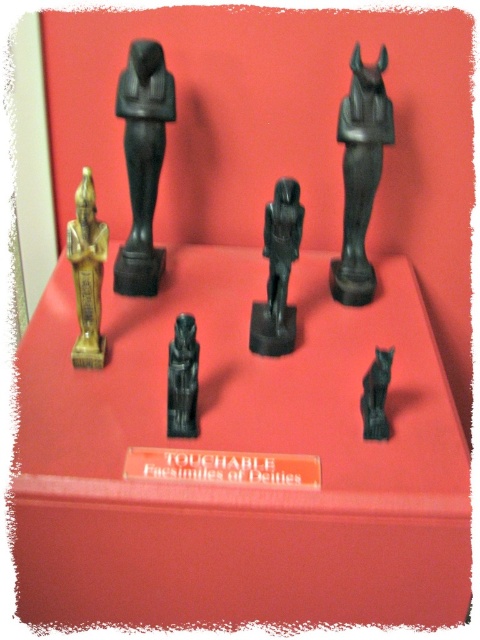
You are an archaeologist examining the display of six black stone figurines on the red pedestal. You notice the black stone statue at upper center and another figurine positioned to its right. Which figurine is closer to the center of the pedestal?

The black stone statue at upper center is located at point (360,173), so it is closer to the center of the pedestal than the other figurine to its right.

You are an art curator examining the display of ancient Egyptian figurines. You need to determine the spatial arrangement between the black stone statue at upper center and the gold polished statue at left. Based on the scene, which statue is positioned to the right of the other?

The black stone statue at upper center is positioned to the right of the gold polished statue at left.

You are an art curator planning to move the black polished statue at center and the black stone statue at center to a new exhibit. Since both statues are on the same pedestal, which one is placed higher?

The black polished statue at center is positioned over the black stone statue at center, so it is placed higher.